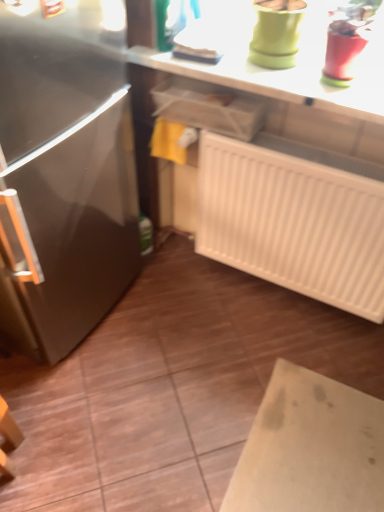
Question: Considering their positions, is smooth white countertop at upper center located in front of or behind white plastic radiator at lower right?

Choices:
 (A) behind
 (B) front

Answer: (B)

Question: Does point (130, 52) appear closer or farther from the camera than point (274, 157)?

Choices:
 (A) farther
 (B) closer

Answer: (B)

Question: Looking at the image, does smooth white countertop at upper center seem bigger or smaller compared to white plastic radiator at lower right?

Choices:
 (A) big
 (B) small

Answer: (B)

Question: From a real-world perspective, relative to smooth white countertop at upper center, is white plastic radiator at lower right vertically above or below?

Choices:
 (A) above
 (B) below

Answer: (B)

Question: In terms of height, does white plastic radiator at lower right look taller or shorter compared to smooth white countertop at upper center?

Choices:
 (A) short
 (B) tall

Answer: (B)

Question: Is white plastic radiator at lower right in front of or behind smooth white countertop at upper center in the image?

Choices:
 (A) front
 (B) behind

Answer: (B)

Question: Considering the relative positions of white plastic radiator at lower right and smooth white countertop at upper center in the image provided, is white plastic radiator at lower right to the left or to the right of smooth white countertop at upper center?

Choices:
 (A) right
 (B) left

Answer: (A)